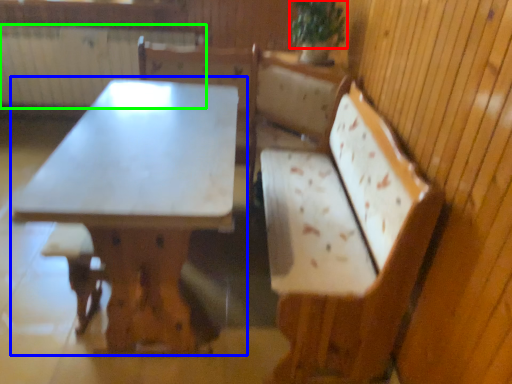
Question: Considering the real-world distances, which object is closest to plant (highlighted by a red box)? table (highlighted by a blue box) or radiator (highlighted by a green box).

Choices:
 (A) table
 (B) radiator

Answer: (A)